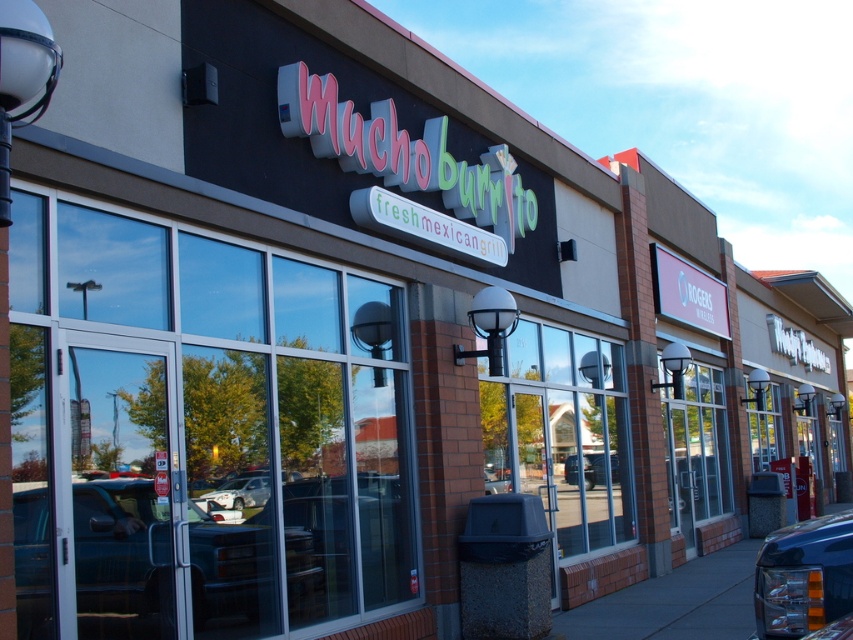
Which is more to the right, shiny black car at center or silver metallic car at center?

From the viewer's perspective, silver metallic car at center appears more on the right side.

Is shiny black car at center below silver metallic car at center?

Yes, shiny black car at center is below silver metallic car at center.

Identify the location of shiny black car at center. This screenshot has height=640, width=853. (120, 557).

Looking at this image, who is positioned more to the left, shiny black car at center or metallic blue truck at lower right?

Positioned to the left is shiny black car at center.

Locate an element on the screen. shiny black car at center is located at coordinates (120, 557).

This screenshot has width=853, height=640. I want to click on shiny black car at center, so click(120, 557).

I want to click on shiny black car at center, so click(120, 557).

Between shiny black car at center and metallic silver sedan at center, which one appears on the left side from the viewer's perspective?

From the viewer's perspective, shiny black car at center appears more on the left side.

Can you confirm if shiny black car at center is wider than metallic silver sedan at center?

Yes, shiny black car at center is wider than metallic silver sedan at center.

Is point (289, 621) closer to camera compared to point (596, 470)?

That is True.

I want to click on shiny black car at center, so click(120, 557).